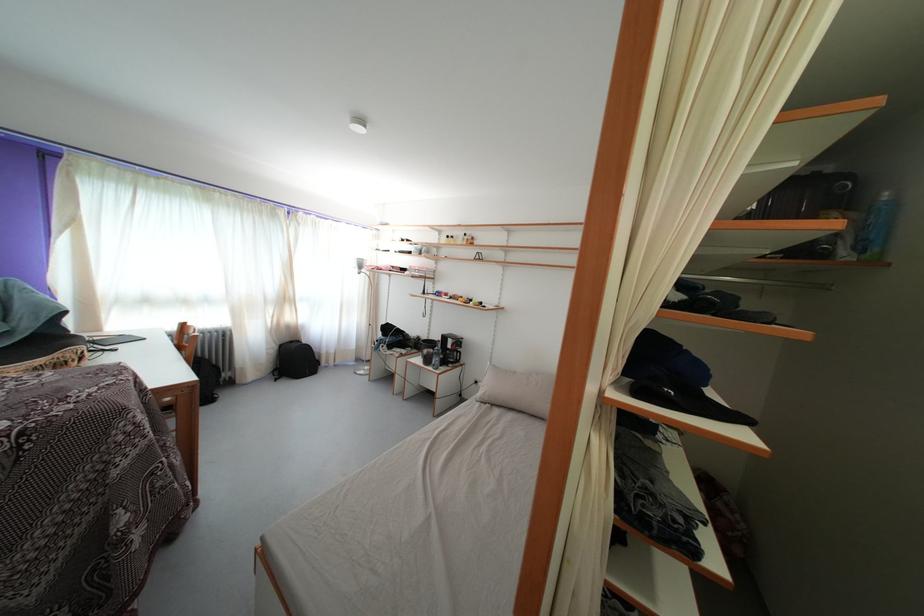
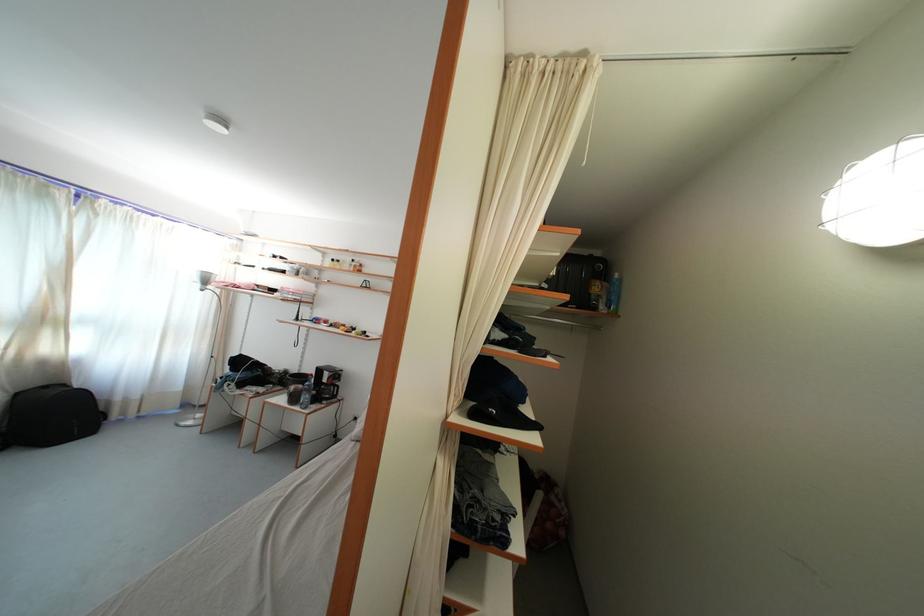
Locate, in the second image, the point that corresponds to [286,352] in the first image.

(23, 400)